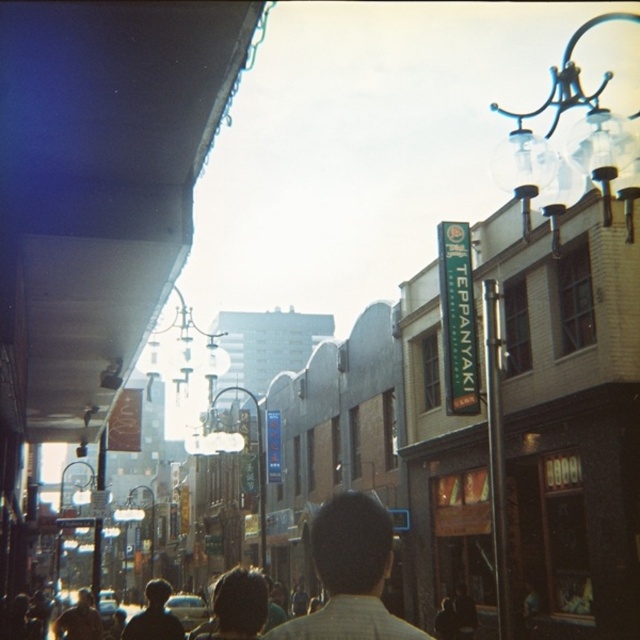
You are a photographer standing in the middle of the bustling street scene. You notice a person wearing a light brown shirt at center and another person with dark brown hair at center. Which of these two has a narrower silhouette from your viewpoint?

The light brown shirt at center is thinner than the dark brown hair at center, so the person wearing the light brown shirt at center has a narrower silhouette.

You are a photographer standing on the bustling street scene. You want to take a photo of the TEPPANYAKI restaurant sign on the right side. There is a person wearing a light brown shirt at center in the way. Where should you move to avoid the person?

Move to the left side of the light brown shirt at center to avoid blocking the view of the TEPPANYAKI restaurant sign on the right side.